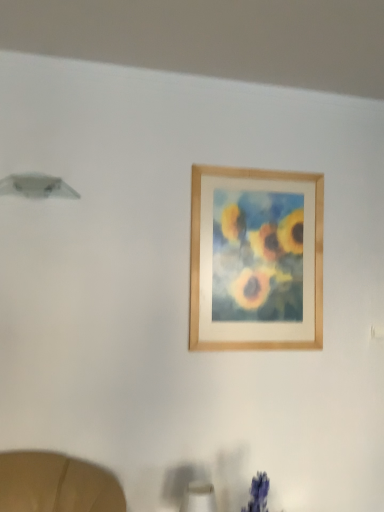
Question: Should I look upward or downward to see white matte table lamp at lower center?

Choices:
 (A) down
 (B) up

Answer: (A)

Question: Is the depth of wooden frame at upper center less than that of white matte table lamp at lower center?

Choices:
 (A) yes
 (B) no

Answer: (B)

Question: Are wooden frame at upper center and white matte table lamp at lower center far apart?

Choices:
 (A) no
 (B) yes

Answer: (A)

Question: Is wooden frame at upper center bigger than white matte table lamp at lower center?

Choices:
 (A) yes
 (B) no

Answer: (A)

Question: From the image's perspective, is wooden frame at upper center over white matte table lamp at lower center?

Choices:
 (A) yes
 (B) no

Answer: (A)

Question: From a real-world perspective, is wooden frame at upper center positioned over white matte table lamp at lower center based on gravity?

Choices:
 (A) no
 (B) yes

Answer: (B)

Question: Can you confirm if wooden frame at upper center is positioned to the left of white matte table lamp at lower center?

Choices:
 (A) yes
 (B) no

Answer: (B)

Question: From the image's perspective, would you say white matte table lamp at lower center is shown under wooden frame at upper center?

Choices:
 (A) yes
 (B) no

Answer: (A)

Question: Is white matte table lamp at lower center bigger than wooden frame at upper center?

Choices:
 (A) yes
 (B) no

Answer: (B)

Question: Is white matte table lamp at lower center not inside wooden frame at upper center?

Choices:
 (A) no
 (B) yes

Answer: (B)

Question: Does white matte table lamp at lower center have a lesser width compared to wooden frame at upper center?

Choices:
 (A) yes
 (B) no

Answer: (B)

Question: Can you confirm if white matte table lamp at lower center is positioned to the right of wooden frame at upper center?

Choices:
 (A) no
 (B) yes

Answer: (A)

Question: Is white matte table lamp at lower center closer to camera compared to wooden frame at upper center?

Choices:
 (A) no
 (B) yes

Answer: (B)

Question: Is white matte table lamp at lower center in front of or behind wooden frame at upper center in the image?

Choices:
 (A) behind
 (B) front

Answer: (B)